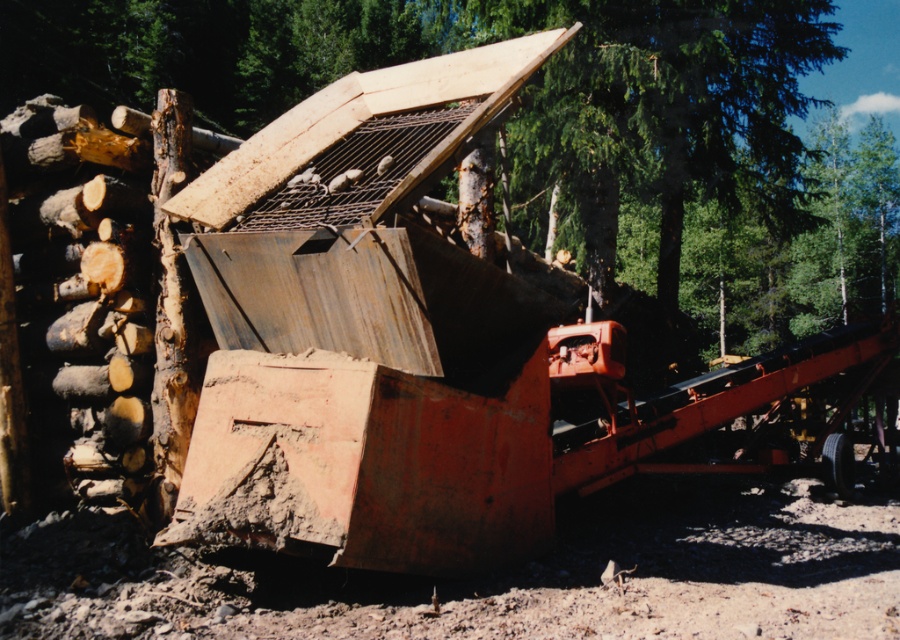
You are a delivery driver who needs to park your truck in the logging area shown in the image. The parking spot is at coordinates 0.695, 0.552. Is the rusty metal trailer truck at center already occupying that spot?

The 2D location of the rusty metal trailer truck at center is at point [496,444], so yes, the truck is already occupying the parking spot at those coordinates.

You are a worker in the logging area. You need to transport both the rusty metal trailer truck at center and the smooth wooden log at center using a crane. Which object should you lift first if you want to place them in order from shortest to tallest?

The rusty metal trailer truck at center is shorter than the smooth wooden log at center, so you should lift the rusty metal trailer truck at center first to arrange them from shortest to tallest.

Based on the photo, you are a delivery driver who needs to transport both the rusty metal trailer truck at center and the smooth wooden log at center through a narrow forest path that can only accommodate items up to 2 meters wide. Based on the scene, can both items pass through the path without any modifications?

The rusty metal trailer truck at center is narrower than the smooth wooden log at center. Since the path can only accommodate items up to 2 meters wide, the log might be too wide to pass, but the trailer truck can. However, without knowing the exact width of the log, it is uncertain if both can pass.